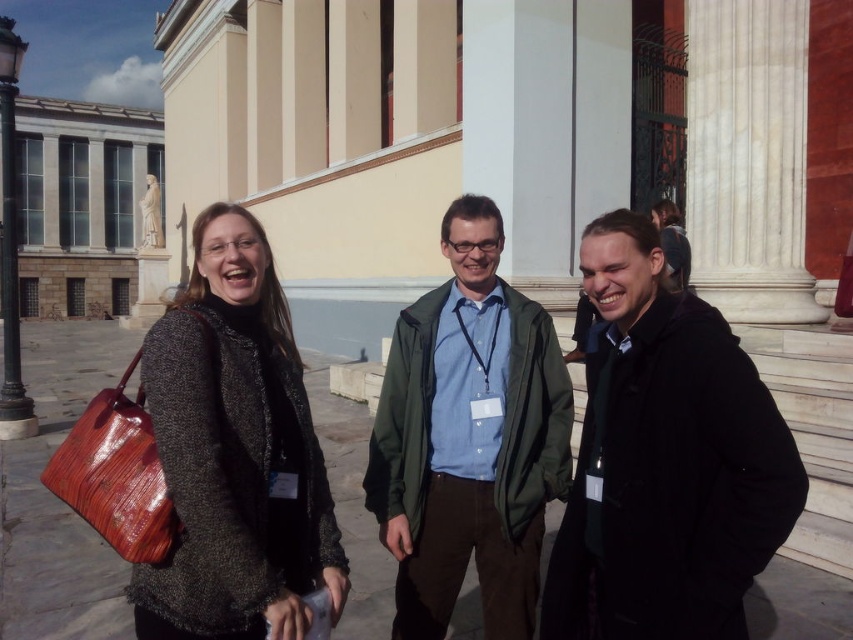
Question: Which object appears farthest from the camera in this image?

Choices:
 (A) black matte jacket at center
 (B) green matte jacket at center
 (C) knitted gray sweater at center

Answer: (B)

Question: Which point is closer to the camera taking this photo?

Choices:
 (A) (582, 547)
 (B) (553, 449)

Answer: (A)

Question: Can you confirm if black matte jacket at center is positioned above knitted gray sweater at center?

Choices:
 (A) yes
 (B) no

Answer: (B)

Question: Is knitted gray sweater at center thinner than green matte jacket at center?

Choices:
 (A) no
 (B) yes

Answer: (A)

Question: Is knitted gray sweater at center to the right of green matte jacket at center from the viewer's perspective?

Choices:
 (A) no
 (B) yes

Answer: (A)

Question: Which of the following is the farthest from the observer?

Choices:
 (A) knitted gray sweater at center
 (B) green matte jacket at center

Answer: (B)